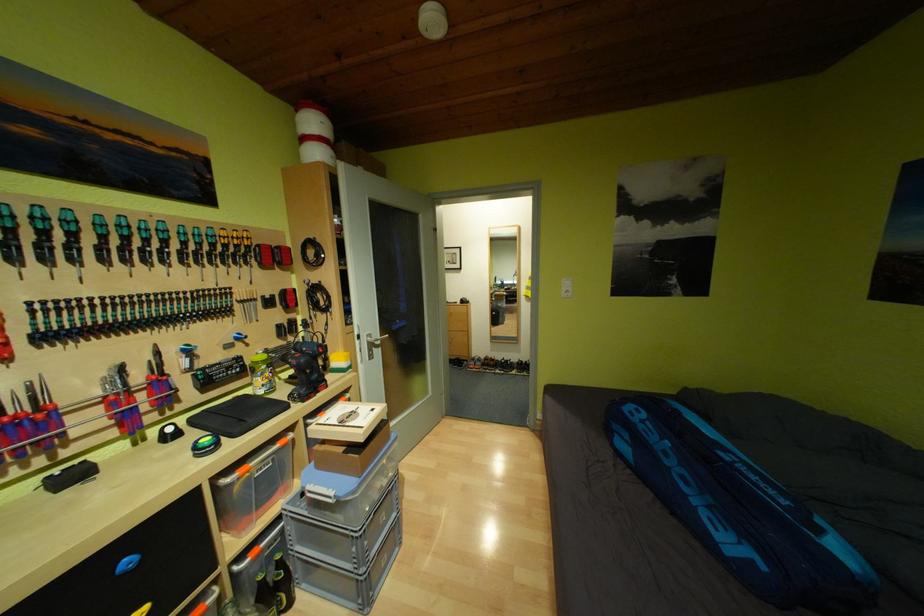
The width and height of the screenshot is (924, 616). I want to click on grey crate handle, so (319, 509).